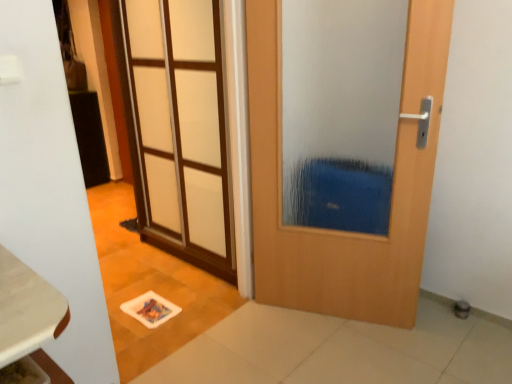
You are a GUI agent. You are given a task and a screenshot of the screen. Output one action in this format:
    pyautogui.click(x=<x>, y=<y>)
    Task: Click on the free space to the left of white frosted glass door at upper left, which is counted as the first door, starting from the left
    
    Given the screenshot: What is the action you would take?
    pyautogui.click(x=119, y=259)